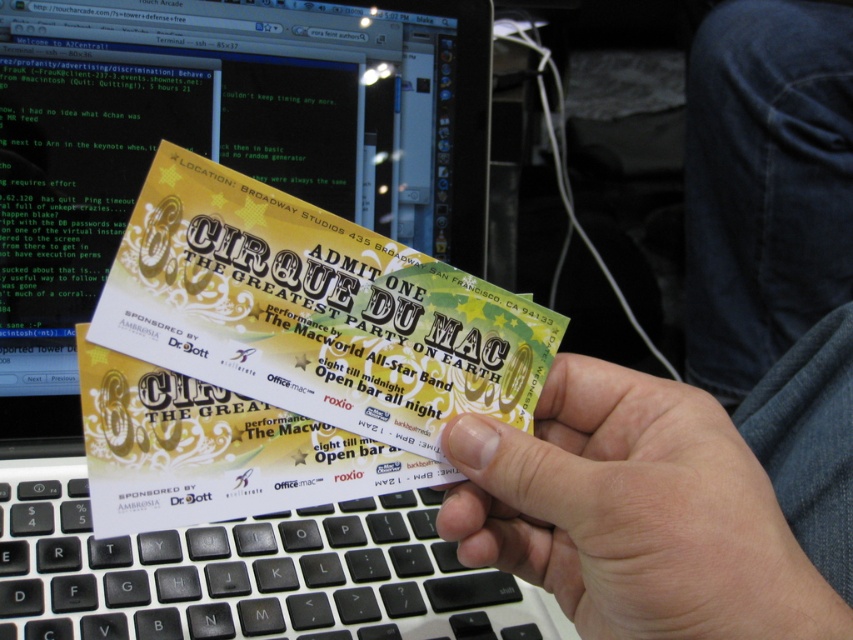
You are a ticket inspector at the Cirque du Mac event. You need to check the tickets held by the person in the image. Can you confirm if the yellow paper ticket at center is small enough to fit within the palm of the smooth skin hand at center?

The yellow paper ticket at center is smaller than the smooth skin hand at center, so it can fit within the palm of the hand.

You are organizing an event and need to ensure that the tickets fit comfortably in attendees hands. Looking at the yellow paper ticket at center and the smooth skin hand at center in the image, can you determine if the ticket will be too large for the hand to hold comfortably?

The yellow paper ticket at center is larger than the smooth skin hand at center, so the ticket may be too large to hold comfortably in the hand.